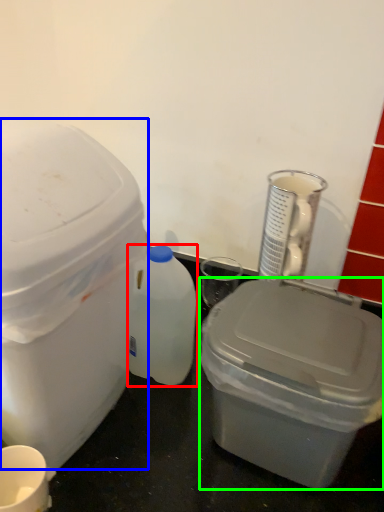
Question: Which object is positioned closest to bottle (highlighted by a red box)? Select from storage box (highlighted by a blue box) and storage box (highlighted by a green box).

Choices:
 (A) storage box
 (B) storage box

Answer: (A)